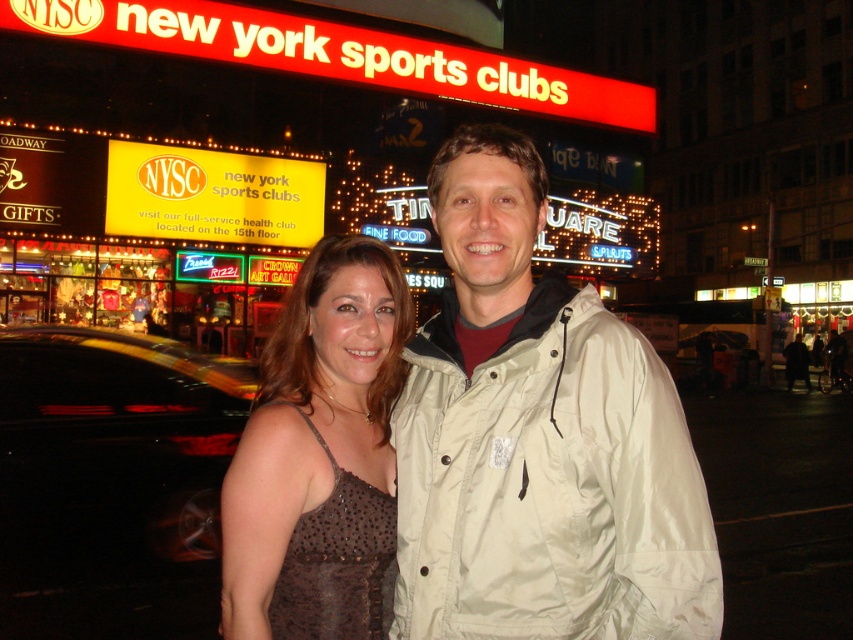
You are a photographer taking a picture of the couple in front of the New York Sports Clubs sign. You notice the light beige jacket at center and the brown satin dress at center. Which clothing item is covering part of the other?

The light beige jacket at center is positioned over the brown satin dress at center, so it is covering part of it.

You are a photographer trying to capture a candid shot of the couple in the scene. You notice the light beige jacket at center and the brown satin dress at center. Which clothing item would you focus on to ensure both are fully visible in the frame?

The light beige jacket at center might be wider than brown satin dress at center, so focusing on the light beige jacket at center would ensure both are fully visible in the frame.

You are a photographer trying to capture the couple in front of the New York Sports Clubs sign. The light beige jacket at center and brown satin dress at center are both in the frame. Which clothing item will appear larger in the photo?

The light beige jacket at center will appear larger in the photo because it is much taller than the brown satin dress at center.